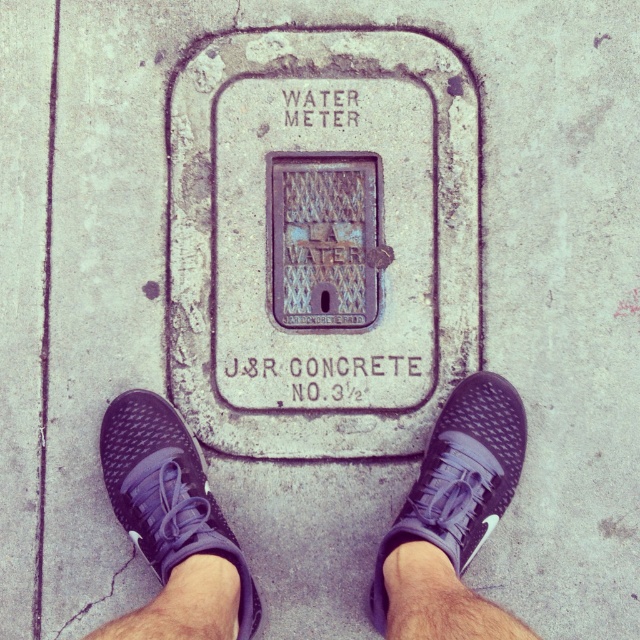
Does matte black shoe at center appear over black mesh shoe at center?

No, matte black shoe at center is not above black mesh shoe at center.

Which is below, matte black shoe at center or black mesh shoe at center?

Positioned lower is matte black shoe at center.

Who is more forward, (131, 436) or (461, 492)?

Point (461, 492) is more forward.

You are a GUI agent. You are given a task and a screenshot of the screen. Output one action in this format:
    pyautogui.click(x=<x>, y=<y>)
    Task: Click on the matte black shoe at center
    
    Given the screenshot: What is the action you would take?
    pyautogui.click(x=168, y=493)

Between point (148, 442) and point (147, 508), which one is positioned in front?

Point (147, 508) is more forward.

Image resolution: width=640 pixels, height=640 pixels. Identify the location of black mesh sneakers at center. (452, 518).

Identify the location of black mesh sneakers at center. The height and width of the screenshot is (640, 640). (452, 518).

Is point (220, 625) closer to viewer compared to point (499, 516)?

Yes, it is.

Is black mesh sneakers at center wider than black mesh shoe at center?

Incorrect, black mesh sneakers at center's width does not surpass black mesh shoe at center's.

Is point (124, 525) closer to viewer compared to point (460, 534)?

No, it is not.

At what (x,y) coordinates should I click in order to perform the action: click on black mesh sneakers at center. Please return your answer as a coordinate pair (x, y). Looking at the image, I should click on (452, 518).